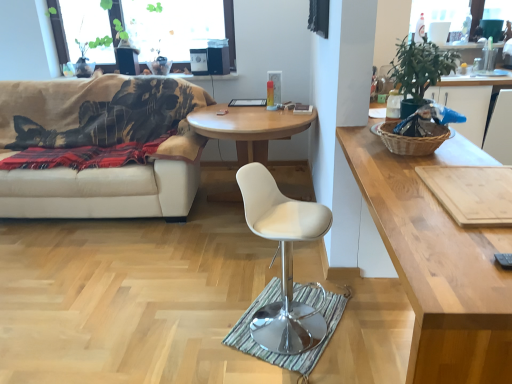
Locate an element on the screen. The image size is (512, 384). free area in between wooden cutting board at right and brown woven picnic basket at right is located at coordinates (438, 171).